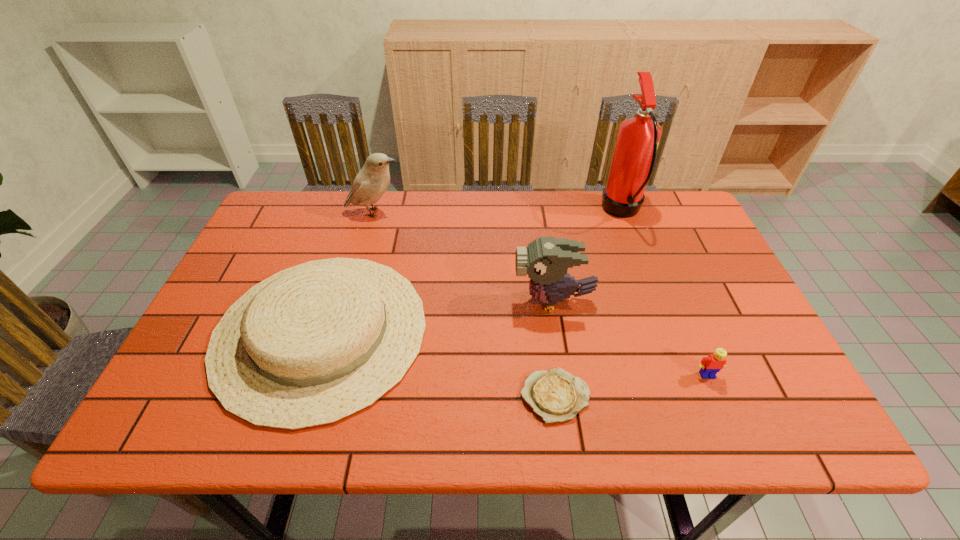
Where is `the tallest object`? the tallest object is located at coordinates (634, 156).

At what (x,y) coordinates should I click in order to perform the action: click on the farther bird. Please return your answer as a coordinate pair (x, y). Looking at the image, I should click on (372, 181).

Image resolution: width=960 pixels, height=540 pixels. I want to click on the nearer bird, so click(x=546, y=260).

Where is `sunhat`? sunhat is located at coordinates (313, 344).

Locate an element on the screen. Lego is located at coordinates (710, 365).

The width and height of the screenshot is (960, 540). What are the coordinates of `quiche` in the screenshot? It's located at (555, 395).

I want to click on vacant area situated 0.300m at the spray nozzle of the fire extinguisher, so click(x=505, y=212).

The image size is (960, 540). Identify the location of vacant space located at the spray nozzle of the fire extinguisher. (518, 212).

This screenshot has height=540, width=960. I want to click on free space located at the spray nozzle of the fire extinguisher, so click(547, 212).

Image resolution: width=960 pixels, height=540 pixels. I want to click on free point located 0.360m at the beak of the left bird, so click(x=519, y=212).